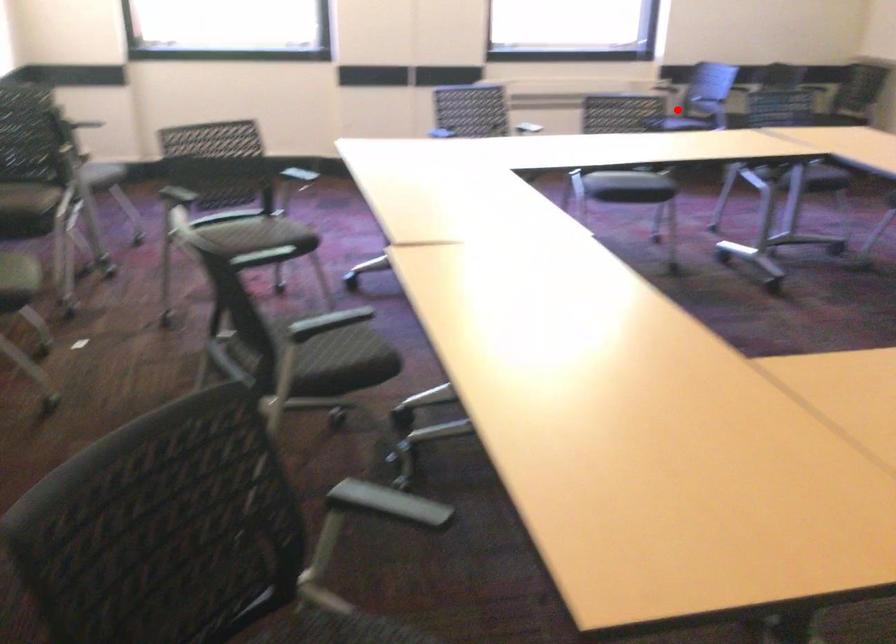
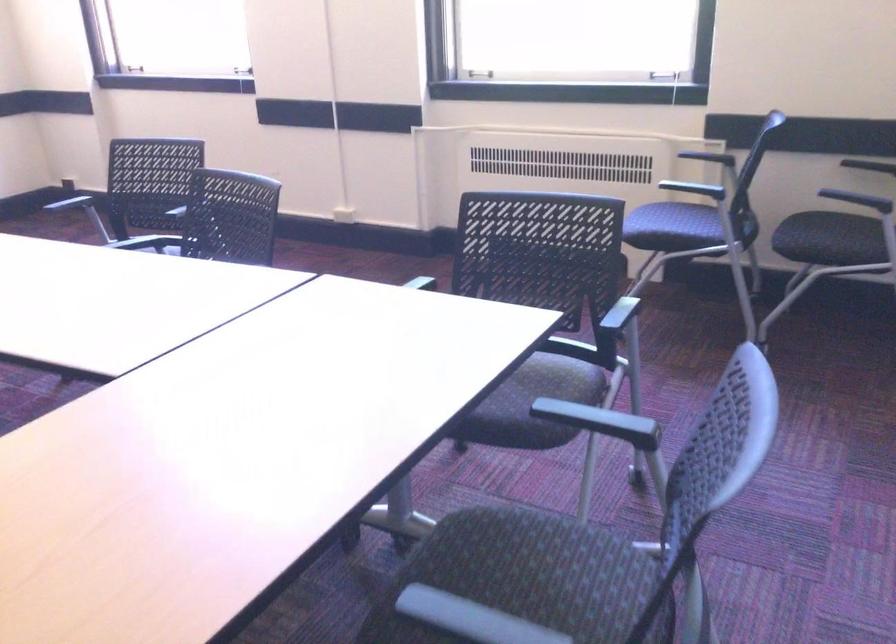
Question: I am providing you with two images of the same scene from different viewpoints. In image1, a red point is highlighted. Considering the same 3D point in image2, which of the following is correct?

Choices:
 (A) It is closer
 (B) It is farther

Answer: (A)